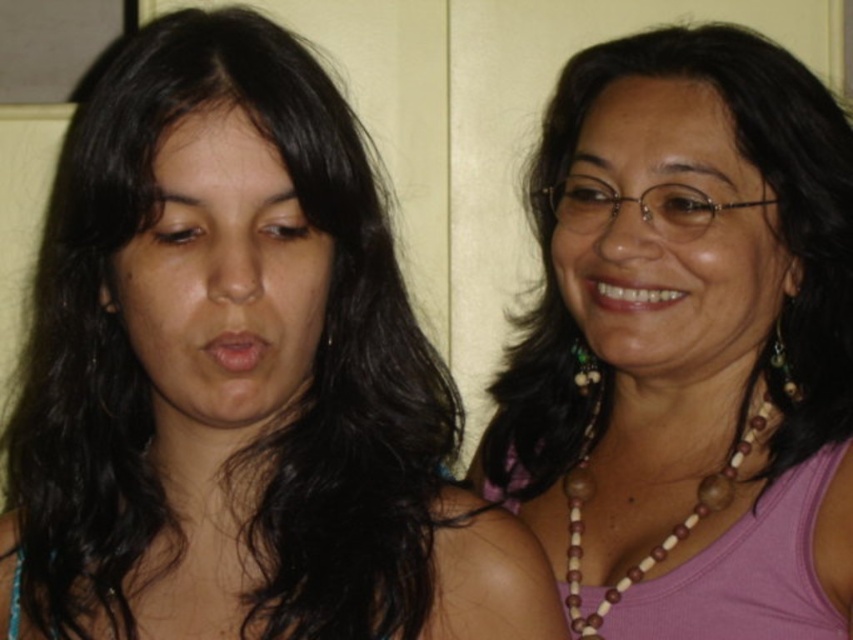
You are taking a photo of two people standing against a wall. The camera you are using has a minimum focus distance of 26 inches. Based on the scene, will the point at point (123, 566) be in focus?

The point at point (123, 566) is 27.07 inches from the camera, which is beyond the minimum focus distance of 26 inches. Therefore, the point will be in focus.

You are a photographer taking a portrait of the two individuals in the scene. You notice the dark brown hair at left and the matte skin face at left. Which object is closer to the camera?

The dark brown hair at left is closer to the camera because it is in front of the matte skin face at left.